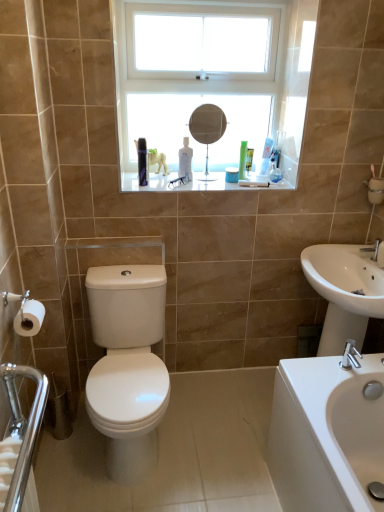
Measure the distance between point (39,380) and camera.

Point (39,380) is 1.94 meters away from camera.

Identify the location of white glossy sink at right, acting as the first sink starting from the top. The image size is (384, 512). point(344,292).

Find the location of a particular element. The image size is (384, 512). green matte bottle at upper center, arranged as the 2th toiletry when viewed from the back is located at coordinates (231, 175).

Where is `silver metallic faucet at right`? This screenshot has width=384, height=512. silver metallic faucet at right is located at coordinates (375, 250).

Is point (32, 332) closer to viewer compared to point (216, 172)?

Yes, point (32, 332) is in front of point (216, 172).

From the image's perspective, which object appears higher, white matte toilet paper at lower left or white glass window at upper center?

white glass window at upper center.

Between white matte toilet paper at lower left and white glass window at upper center, which one has less height?

white matte toilet paper at lower left is shorter.

Is white matte toilet paper at lower left completely or partially outside of white glass window at upper center?

That's correct, white matte toilet paper at lower left is outside of white glass window at upper center.

From their relative heights in the image, would you say white glossy sink at lower right, which appears as the first sink when ordered from the bottom, is taller or shorter than white glossy sink at right, the second sink in the bottom-to-top sequence?

white glossy sink at lower right, which appears as the first sink when ordered from the bottom, is taller than white glossy sink at right, the second sink in the bottom-to-top sequence.

Considering the relative sizes of white glossy sink at lower right, which is the 2th sink in top-to-bottom order, and white glossy sink at right, the second sink in the bottom-to-top sequence, in the image provided, is white glossy sink at lower right, which is the 2th sink in top-to-bottom order, smaller than white glossy sink at right, the second sink in the bottom-to-top sequence,?

Actually, white glossy sink at lower right, which is the 2th sink in top-to-bottom order, might be larger than white glossy sink at right, the second sink in the bottom-to-top sequence.

What's the angular difference between white glossy sink at lower right, which appears as the first sink when ordered from the bottom, and white glossy sink at right, acting as the first sink starting from the top,'s facing directions?

There is a 0.626-degree angle between the facing directions of white glossy sink at lower right, which appears as the first sink when ordered from the bottom, and white glossy sink at right, acting as the first sink starting from the top.

Considering the positions of point (356, 437) and point (371, 278), is point (356, 437) closer or farther from the camera than point (371, 278)?

Point (356, 437) is closer to the camera than point (371, 278).

Considering the sizes of translucent plastic toothbrush at upper center, which ranks as the first toiletry in top-to-bottom order, and white glossy sink at right, the second sink in the bottom-to-top sequence, in the image, is translucent plastic toothbrush at upper center, which ranks as the first toiletry in top-to-bottom order, bigger or smaller than white glossy sink at right, the second sink in the bottom-to-top sequence,?

translucent plastic toothbrush at upper center, which ranks as the first toiletry in top-to-bottom order, is smaller than white glossy sink at right, the second sink in the bottom-to-top sequence.

Which is in front, translucent plastic toothbrush at upper center, positioned as the first toiletry in back-to-front order, or white glossy sink at right, acting as the first sink starting from the top?

white glossy sink at right, acting as the first sink starting from the top, is more forward.

Is translucent plastic toothbrush at upper center, marked as the first toiletry in a right-to-left arrangement, looking in the opposite direction of white glossy sink at right, acting as the first sink starting from the top?

No, translucent plastic toothbrush at upper center, marked as the first toiletry in a right-to-left arrangement,'s orientation is not away from white glossy sink at right, acting as the first sink starting from the top.

Is translucent plastic toothbrush at upper center, which is the 2th toiletry from left to right, at the left side of white glossy sink at right, acting as the first sink starting from the top?

Yes.

Who is taller, white glossy sink at lower right, which appears as the first sink when ordered from the bottom, or silver metallic faucet at right?

With more height is white glossy sink at lower right, which appears as the first sink when ordered from the bottom.

Where is `sink that is the 2nd one when counting downward from the silver metallic faucet at right (from the image's perspective)`? The image size is (384, 512). sink that is the 2nd one when counting downward from the silver metallic faucet at right (from the image's perspective) is located at coordinates (326, 435).

Between white glossy sink at lower right, which appears as the first sink when ordered from the bottom, and silver metallic faucet at right, which one has smaller size?

With smaller size is silver metallic faucet at right.

Could you tell me if white glossy sink at lower right, which is the 2th sink in top-to-bottom order, is facing silver metallic faucet at right?

No, white glossy sink at lower right, which is the 2th sink in top-to-bottom order, is not oriented towards silver metallic faucet at right.

Does polished chrome grab bar at lower left have a greater width compared to white glossy sink at right, acting as the first sink starting from the top?

Incorrect, the width of polished chrome grab bar at lower left does not surpass that of white glossy sink at right, acting as the first sink starting from the top.

From a real-world perspective, which is physically above, polished chrome grab bar at lower left or white glossy sink at right, the second sink in the bottom-to-top sequence?

white glossy sink at right, the second sink in the bottom-to-top sequence.

From the image's perspective, is polished chrome grab bar at lower left located above white glossy sink at right, the second sink in the bottom-to-top sequence?

Actually, polished chrome grab bar at lower left appears below white glossy sink at right, the second sink in the bottom-to-top sequence, in the image.

Is white glossy sink at lower right, which is the 2th sink in top-to-bottom order, positioned far away from polished chrome grab bar at lower left?

Absolutely, white glossy sink at lower right, which is the 2th sink in top-to-bottom order, is distant from polished chrome grab bar at lower left.

Can you tell me how much white glossy sink at lower right, which is the 2th sink in top-to-bottom order, and polished chrome grab bar at lower left differ in facing direction?

The angular difference between white glossy sink at lower right, which is the 2th sink in top-to-bottom order, and polished chrome grab bar at lower left is 180 degrees.

Considering the sizes of objects white glossy sink at lower right, which appears as the first sink when ordered from the bottom, and polished chrome grab bar at lower left in the image provided, who is wider, white glossy sink at lower right, which appears as the first sink when ordered from the bottom, or polished chrome grab bar at lower left?

white glossy sink at lower right, which appears as the first sink when ordered from the bottom, is wider.

Considering the sizes of objects white glossy sink at lower right, which appears as the first sink when ordered from the bottom, and polished chrome grab bar at lower left in the image provided, who is smaller, white glossy sink at lower right, which appears as the first sink when ordered from the bottom, or polished chrome grab bar at lower left?

Smaller between the two is polished chrome grab bar at lower left.

How different are the orientations of translucent plastic toothbrush at upper center, marked as the first toiletry in a right-to-left arrangement, and matte silver mirror at center in degrees?

translucent plastic toothbrush at upper center, marked as the first toiletry in a right-to-left arrangement, and matte silver mirror at center are facing 0.000355 degrees away from each other.

Which object is more forward, translucent plastic toothbrush at upper center, positioned as the first toiletry in back-to-front order, or matte silver mirror at center?

matte silver mirror at center.

The height and width of the screenshot is (512, 384). Find the location of `the 1st toiletry below the matte silver mirror at center (from a real-world perspective)`. the 1st toiletry below the matte silver mirror at center (from a real-world perspective) is located at coordinates (266, 156).

Can you confirm if translucent plastic toothbrush at upper center, marked as the first toiletry in a right-to-left arrangement, is positioned to the right of matte silver mirror at center?

Indeed, translucent plastic toothbrush at upper center, marked as the first toiletry in a right-to-left arrangement, is positioned on the right side of matte silver mirror at center.

Locate an element on the screen. The width and height of the screenshot is (384, 512). window that appears above the white matte toilet paper at lower left (from the image's perspective) is located at coordinates (211, 84).

Image resolution: width=384 pixels, height=512 pixels. I want to click on sink on the left of white glossy sink at right, the second sink in the bottom-to-top sequence, so click(326, 435).

In the scene shown: From the image, which object appears to be nearer to silver metallic faucet at right, polished chrome grab bar at lower left or matte silver mirror at center?

Based on the image, matte silver mirror at center appears to be nearer to silver metallic faucet at right.

Considering their positions, is white glossy sink at right, acting as the first sink starting from the top, positioned closer to white matte toilet paper at lower left than green matte bottle at upper center, the second toiletry viewed from the top?

Among the two, green matte bottle at upper center, the second toiletry viewed from the top, is located nearer to white matte toilet paper at lower left.

When comparing their distances from matte silver mirror at center, does white matte toilet paper at lower left or silver metallic faucet at right seem closer?

silver metallic faucet at right lies closer to matte silver mirror at center than the other object.

Estimate the real-world distances between objects in this image. Which object is closer to translucent plastic toothbrush at upper center, which ranks as the first toiletry in top-to-bottom order, green matte bottle at upper center, which appears as the 2th toiletry when viewed from the right, or matte silver mirror at center?

Among the two, green matte bottle at upper center, which appears as the 2th toiletry when viewed from the right, is located nearer to translucent plastic toothbrush at upper center, which ranks as the first toiletry in top-to-bottom order.

When comparing their distances from white glossy sink at lower right, which appears as the first sink when ordered from the bottom, does polished chrome grab bar at lower left or translucent plastic toothbrush at upper center, which ranks as the first toiletry in top-to-bottom order, seem further?

The object further to white glossy sink at lower right, which appears as the first sink when ordered from the bottom, is translucent plastic toothbrush at upper center, which ranks as the first toiletry in top-to-bottom order.

When comparing their distances from white glass window at upper center, does matte silver mirror at center or white glossy sink at lower right, which appears as the first sink when ordered from the bottom, seem further?

white glossy sink at lower right, which appears as the first sink when ordered from the bottom.

From the image, which object appears to be nearer to white glass window at upper center, white glossy sink at right, acting as the first sink starting from the top, or matte silver mirror at center?

matte silver mirror at center is positioned closer to the anchor white glass window at upper center.

Estimate the real-world distances between objects in this image. Which object is closer to polished chrome grab bar at lower left, white matte toilet paper at lower left or white glass window at upper center?

white matte toilet paper at lower left.

Identify the location of toiletry between white glass window at upper center and green matte bottle at upper center, the second toiletry viewed from the top, in the up-down direction. (266, 156).

The image size is (384, 512). Find the location of `tap between matte silver mirror at center and white glossy sink at lower right, which appears as the first sink when ordered from the bottom, vertically`. tap between matte silver mirror at center and white glossy sink at lower right, which appears as the first sink when ordered from the bottom, vertically is located at coordinates (375, 250).

Where is `mirror that lies between white glass window at upper center and white glossy sink at lower right, which is the 2th sink in top-to-bottom order, from top to bottom`? This screenshot has height=512, width=384. mirror that lies between white glass window at upper center and white glossy sink at lower right, which is the 2th sink in top-to-bottom order, from top to bottom is located at coordinates (207, 129).

Where is `tap between polished chrome grab bar at lower left and matte silver mirror at center in the front-back direction`? This screenshot has width=384, height=512. tap between polished chrome grab bar at lower left and matte silver mirror at center in the front-back direction is located at coordinates (375, 250).